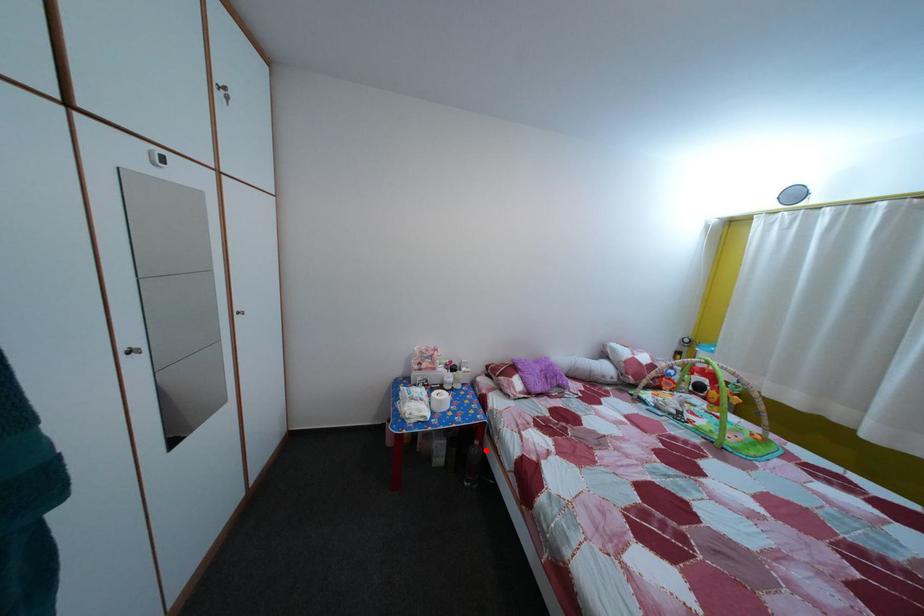
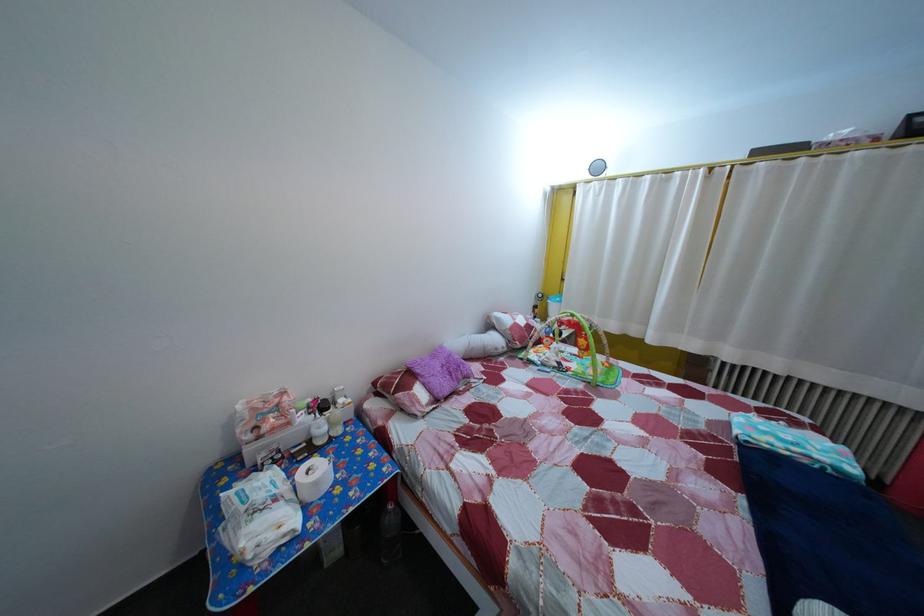
In the second image, find the point that corresponds to the highlighted location in the first image.

(399, 515)